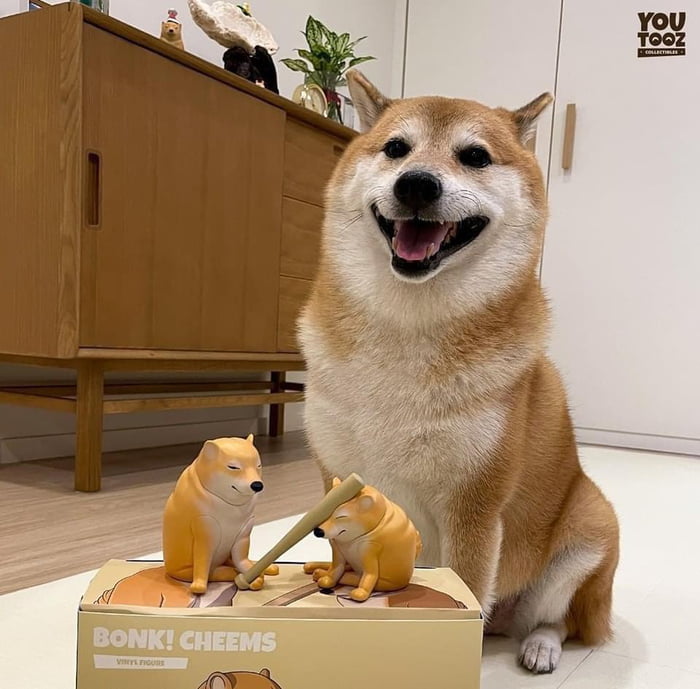
Find the location of a particular element. white cabinet doors is located at coordinates (647, 269), (498, 94).